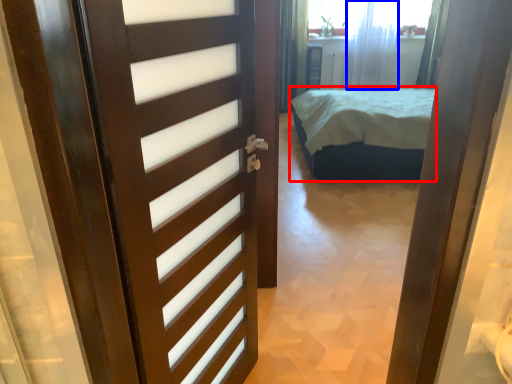
Question: Which point is closer to the camera, bed (highlighted by a red box) or curtain (highlighted by a blue box)?

Choices:
 (A) bed
 (B) curtain

Answer: (A)